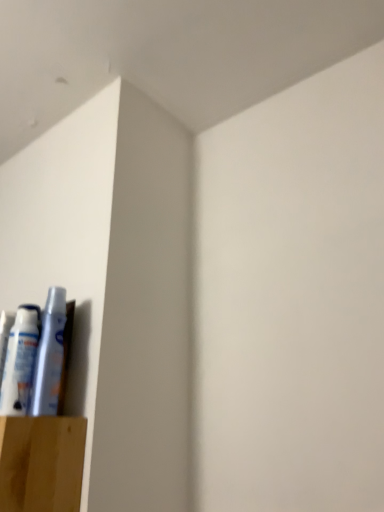
Question: Would you say white plastic tube at lower left, positioned as the 2th toiletry in left-to-right order, is a long distance from white matte tube at lower left, which is the first toiletry in left-to-right order?

Choices:
 (A) no
 (B) yes

Answer: (A)

Question: Considering the relative sizes of white plastic tube at lower left, arranged as the 1th toiletry when viewed from the right, and white matte tube at lower left, which is the first toiletry in left-to-right order, in the image provided, is white plastic tube at lower left, arranged as the 1th toiletry when viewed from the right, thinner than white matte tube at lower left, which is the first toiletry in left-to-right order,?

Choices:
 (A) no
 (B) yes

Answer: (B)

Question: Is white matte tube at lower left, which is the 2th toiletry from right to left, surrounded by white plastic tube at lower left, positioned as the 2th toiletry in left-to-right order?

Choices:
 (A) no
 (B) yes

Answer: (A)

Question: Is white plastic tube at lower left, arranged as the 1th toiletry when viewed from the right, touching white matte tube at lower left, which is the 2th toiletry from right to left?

Choices:
 (A) yes
 (B) no

Answer: (A)

Question: Is the position of white plastic tube at lower left, arranged as the 1th toiletry when viewed from the right, less distant than that of white matte tube at lower left, which is the first toiletry in left-to-right order?

Choices:
 (A) no
 (B) yes

Answer: (B)

Question: From a real-world perspective, is white plastic tube at lower left, positioned as the 2th toiletry in left-to-right order, on top of white matte tube at lower left, which is the first toiletry in left-to-right order?

Choices:
 (A) no
 (B) yes

Answer: (B)

Question: From a real-world perspective, is white matte tube at lower left, which is the first toiletry in left-to-right order, under white plastic tube at lower left, arranged as the 1th toiletry when viewed from the right?

Choices:
 (A) no
 (B) yes

Answer: (B)

Question: Does white matte tube at lower left, which is the first toiletry in left-to-right order, have a smaller size compared to white plastic tube at lower left, arranged as the 1th toiletry when viewed from the right?

Choices:
 (A) yes
 (B) no

Answer: (B)

Question: Is white matte tube at lower left, which is the 2th toiletry from right to left, shorter than white plastic tube at lower left, positioned as the 2th toiletry in left-to-right order?

Choices:
 (A) yes
 (B) no

Answer: (A)

Question: Considering the relative sizes of white matte tube at lower left, which is the first toiletry in left-to-right order, and white plastic tube at lower left, positioned as the 2th toiletry in left-to-right order, in the image provided, is white matte tube at lower left, which is the first toiletry in left-to-right order, bigger than white plastic tube at lower left, positioned as the 2th toiletry in left-to-right order,?

Choices:
 (A) no
 (B) yes

Answer: (B)

Question: Is white matte tube at lower left, which is the 2th toiletry from right to left, not within white plastic tube at lower left, positioned as the 2th toiletry in left-to-right order?

Choices:
 (A) no
 (B) yes

Answer: (B)

Question: Does white matte tube at lower left, which is the 2th toiletry from right to left, have a greater height compared to white plastic tube at lower left, positioned as the 2th toiletry in left-to-right order?

Choices:
 (A) no
 (B) yes

Answer: (A)

Question: From the image's perspective, is white plastic tube at lower left, positioned as the 2th toiletry in left-to-right order, located above or below white matte tube at lower left, which is the 2th toiletry from right to left?

Choices:
 (A) above
 (B) below

Answer: (A)